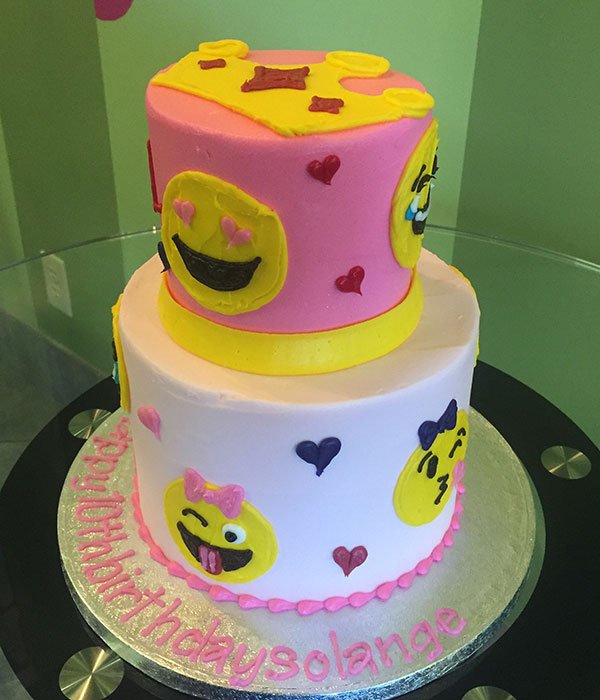
Find the location of a particular element. The width and height of the screenshot is (600, 700). silver cake plate is located at coordinates (471, 563).